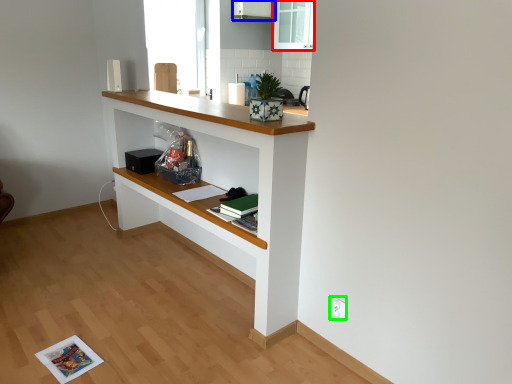
Question: Which is nearer to the glass door (highlighted by a red box)? cabinetry (highlighted by a blue box) or electric outlet (highlighted by a green box).

Choices:
 (A) cabinetry
 (B) electric outlet

Answer: (A)